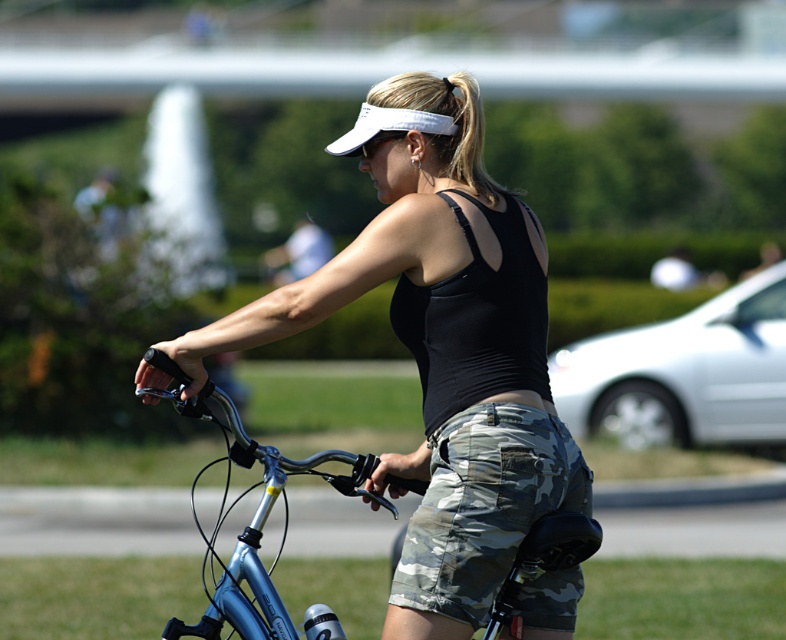
You are a photographer trying to capture the woman on the bicycle. The camera you are using has a focus point at point (476, 512). Which part of the woman should be in focus?

The camo fabric shorts at center is located at point (476, 512), so the focus should be on the camo fabric shorts at center.

You are a fashion designer observing the woman in the image. You need to recommend a size for both her camo fabric shorts at center and black matte tank top at center. Which item requires a larger size to accommodate its width?

The camo fabric shorts at center requires a larger size because its width is greater than the black matte tank top at center.

You are a fashion designer observing a woman in a park. She is wearing the camo fabric shorts at center and the black matte tank top at center. Which clothing item is shorter in length?

The camo fabric shorts at center is shorter than the black matte tank top at center.